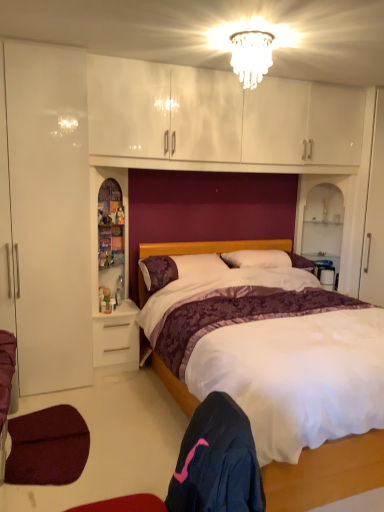
Question: Is translucent plastic bottle at left far from dark blue fabric at lower center?

Choices:
 (A) no
 (B) yes

Answer: (B)

Question: Is translucent plastic bottle at left directly adjacent to dark blue fabric at lower center?

Choices:
 (A) no
 (B) yes

Answer: (A)

Question: Can you confirm if translucent plastic bottle at left is thinner than dark blue fabric at lower center?

Choices:
 (A) no
 (B) yes

Answer: (B)

Question: Does translucent plastic bottle at left appear on the left side of dark blue fabric at lower center?

Choices:
 (A) yes
 (B) no

Answer: (A)

Question: From a real-world perspective, is translucent plastic bottle at left located higher than dark blue fabric at lower center?

Choices:
 (A) no
 (B) yes

Answer: (B)

Question: Is clear glass chandelier at upper center bigger or smaller than translucent plastic bottle at left?

Choices:
 (A) big
 (B) small

Answer: (A)

Question: Is clear glass chandelier at upper center to the left or to the right of translucent plastic bottle at left in the image?

Choices:
 (A) left
 (B) right

Answer: (B)

Question: Considering the positions of point (251, 31) and point (119, 285), is point (251, 31) closer or farther from the camera than point (119, 285)?

Choices:
 (A) farther
 (B) closer

Answer: (B)

Question: Is clear glass chandelier at upper center inside the boundaries of translucent plastic bottle at left, or outside?

Choices:
 (A) outside
 (B) inside

Answer: (A)

Question: Would you say purple satin pillow at center, the first pillow viewed from the right, is to the left or to the right of white satin bed at center in the picture?

Choices:
 (A) right
 (B) left

Answer: (A)

Question: In terms of height, does purple satin pillow at center, acting as the 2th pillow starting from the left, look taller or shorter compared to white satin bed at center?

Choices:
 (A) short
 (B) tall

Answer: (A)

Question: From a real-world perspective, is purple satin pillow at center, the first pillow viewed from the right, positioned above or below white satin bed at center?

Choices:
 (A) above
 (B) below

Answer: (A)

Question: Does point (236, 266) appear closer or farther from the camera than point (276, 482)?

Choices:
 (A) closer
 (B) farther

Answer: (B)

Question: Is point (117, 302) positioned closer to the camera than point (269, 51)?

Choices:
 (A) closer
 (B) farther

Answer: (B)

Question: From the image's perspective, is translucent plastic bottle at left located above or below clear glass chandelier at upper center?

Choices:
 (A) above
 (B) below

Answer: (B)